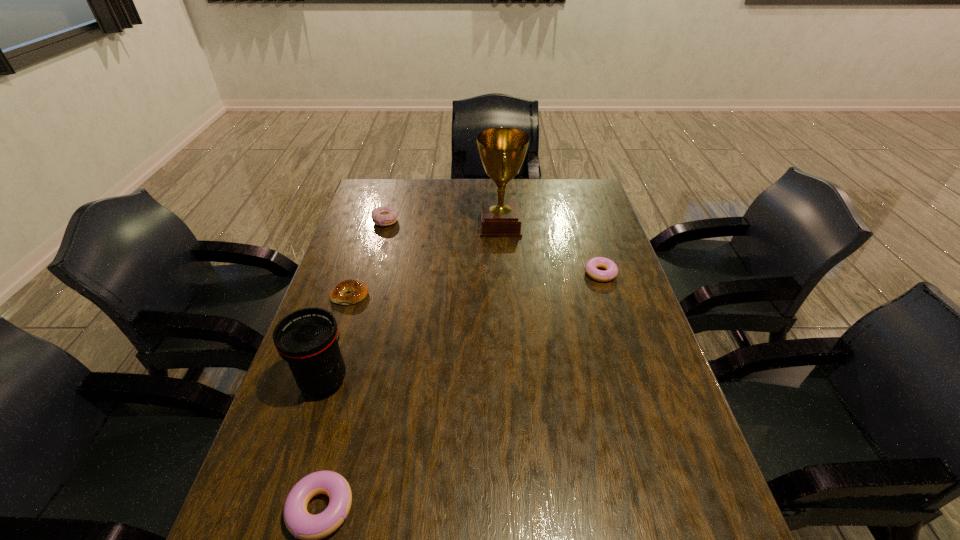
Image resolution: width=960 pixels, height=540 pixels. I want to click on vacant region at the far edge of the desktop, so click(x=535, y=179).

Find the location of a particular element. free space at the left edge of the desktop is located at coordinates (288, 396).

In the image, there is a desktop. Identify the location of vacant region at the right edge. coord(660,430).

I want to click on free region at the far right corner of the desktop, so click(573, 185).

Where is `blank region between the farthest doughnut and the tallest object`? This screenshot has width=960, height=540. blank region between the farthest doughnut and the tallest object is located at coordinates (443, 224).

The height and width of the screenshot is (540, 960). What are the coordinates of `free space that is in between the farthest doughnut and the third nearest object` in the screenshot? It's located at (368, 258).

You are a GUI agent. You are given a task and a screenshot of the screen. Output one action in this format:
    pyautogui.click(x=<x>, y=<y>)
    Task: Click on the empty space between the third farthest object and the fourth farthest object
    
    Given the screenshot: What is the action you would take?
    pyautogui.click(x=475, y=284)

The image size is (960, 540). What are the coordinates of `free space between the tallest object and the fifth farthest object` in the screenshot? It's located at (412, 303).

This screenshot has height=540, width=960. In order to click on free space between the fourth nearest object and the fifth object from left to right in this screenshot , I will do `click(550, 249)`.

Locate which object ranks second in proximity to the bagel. Please provide its 2D coordinates. Your answer should be formatted as a tuple, i.e. [(x, y)], where the tuple contains the x and y coordinates of a point satisfying the conditions above.

[(382, 216)]